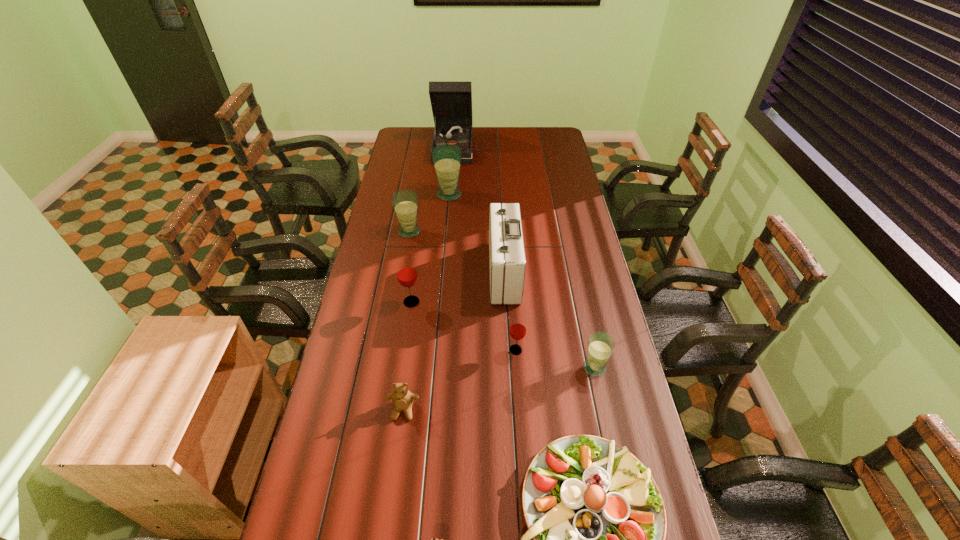
This screenshot has width=960, height=540. I want to click on vacant space at the far left corner of the desktop, so click(x=417, y=130).

In the image, there is a desktop. In order to click on free region at the far right corner in this screenshot , I will do `click(539, 136)`.

Where is `vacant area that lies between the farthest object and the red first-aid kit`? vacant area that lies between the farthest object and the red first-aid kit is located at coordinates (481, 210).

At what (x,y) coordinates should I click in order to perform the action: click on free space between the third nearest object and the farther red glass. Please return your answer as a coordinate pair (x, y). This screenshot has height=540, width=960. Looking at the image, I should click on (407, 356).

Locate an element on the screen. The height and width of the screenshot is (540, 960). free space that is in between the first-aid kit and the leftmost blue glass is located at coordinates point(457,252).

In order to click on object that stands as the closest to the tallest object in this screenshot , I will do `click(446, 158)`.

Locate which object is the ninth closest to the red first-aid kit. Please provide its 2D coordinates. Your answer should be formatted as a tuple, i.e. [(x, y)], where the tuple contains the x and y coordinates of a point satisfying the conditions above.

[(434, 539)]

Identify which glass is the fourth closest to the phonograph_record. Please provide its 2D coordinates. Your answer should be formatted as a tuple, i.e. [(x, y)], where the tuple contains the x and y coordinates of a point satisfying the conditions above.

[(517, 331)]

Select which glass appears as the fourth closest to the nearer red glass. Please provide its 2D coordinates. Your answer should be formatted as a tuple, i.e. [(x, y)], where the tuple contains the x and y coordinates of a point satisfying the conditions above.

[(446, 158)]

Locate an element on the screen. Image resolution: width=960 pixels, height=540 pixels. blue glass that is the third closest to the nearer red glass is located at coordinates (446, 158).